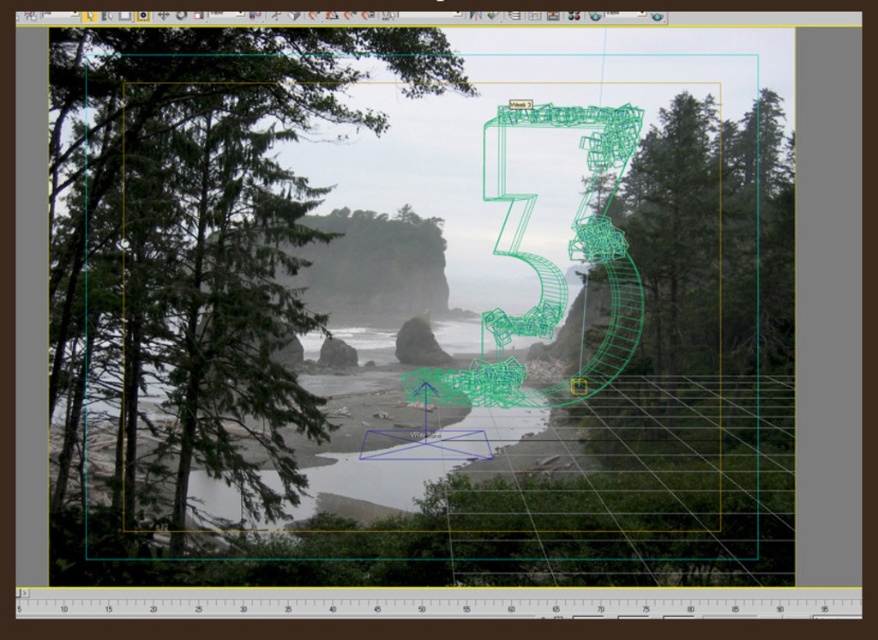
Question: Is the position of green matte tree at center less distant than that of green matte tree at center-right?

Choices:
 (A) no
 (B) yes

Answer: (B)

Question: Which point is farther to the camera?

Choices:
 (A) green matte tree at center
 (B) green matte tree at center-right

Answer: (B)

Question: Based on their relative distances, which object is farther from the green matte tree at center-right?

Choices:
 (A) green matte tree at center
 (B) rough stone rock at center

Answer: (B)

Question: Where is green matte tree at center located in relation to rough stone rock at center in the image?

Choices:
 (A) left
 (B) right

Answer: (A)

Question: Which object is the closest to the green matte tree at center?

Choices:
 (A) rough stone rock at center
 (B) green matte tree at center-right

Answer: (B)

Question: Does green matte tree at center appear under rough stone rock at center?

Choices:
 (A) yes
 (B) no

Answer: (B)